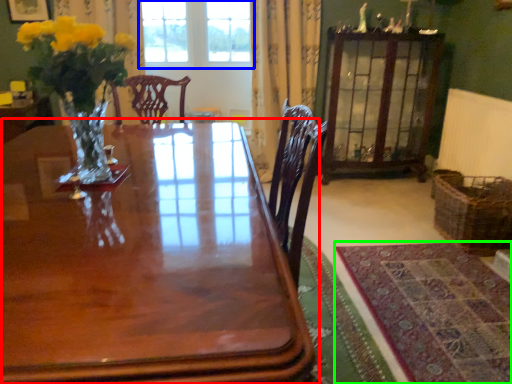
Question: Estimate the real-world distances between objects in this image. Which object is closer to table (highlighted by a red box), window (highlighted by a blue box) or mat (highlighted by a green box)?

Choices:
 (A) window
 (B) mat

Answer: (B)